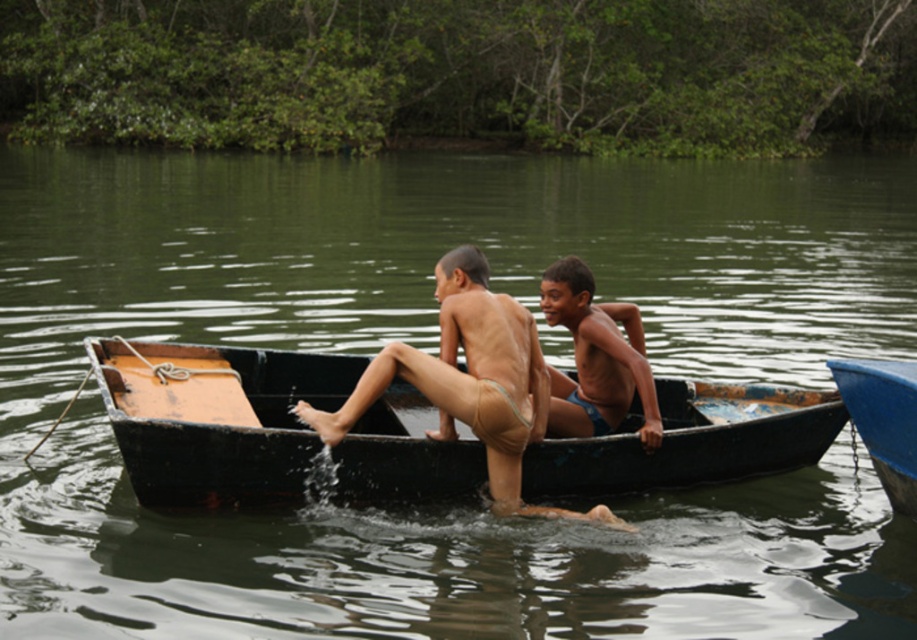
Is rusty metal canoe at center above blue fabric shorts at center?

No.

Identify the location of rusty metal canoe at center. (217, 419).

Is blue fabric shorts at center taller than blue glossy canoe at right?

Correct, blue fabric shorts at center is much taller as blue glossy canoe at right.

Is blue fabric shorts at center above blue glossy canoe at right?

Correct, blue fabric shorts at center is located above blue glossy canoe at right.

Is point (598, 321) positioned behind point (879, 451)?

Yes, it is behind point (879, 451).

The height and width of the screenshot is (640, 917). Identify the location of blue fabric shorts at center. (595, 358).

Measure the distance between rusty metal canoe at center and camera.

rusty metal canoe at center and camera are 33.55 feet apart.

Is rusty metal canoe at center further to the viewer compared to blue glossy canoe at right?

That is True.

Is point (330, 406) positioned behind point (884, 412)?

That is True.

At what (x,y) coordinates should I click in order to perform the action: click on rusty metal canoe at center. Please return your answer as a coordinate pair (x, y). The width and height of the screenshot is (917, 640). Looking at the image, I should click on (217, 419).